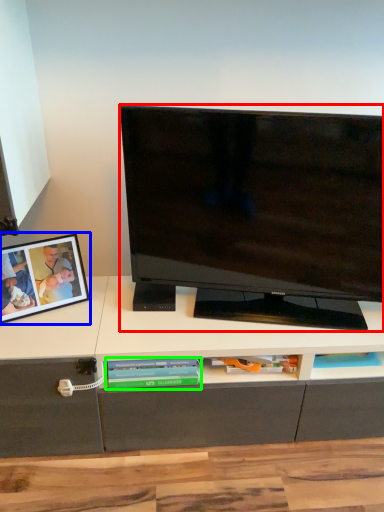
Question: Which object is positioned farthest from television (highlighted by a red box)? Select from picture frame (highlighted by a blue box) and book (highlighted by a green box).

Choices:
 (A) picture frame
 (B) book

Answer: (A)